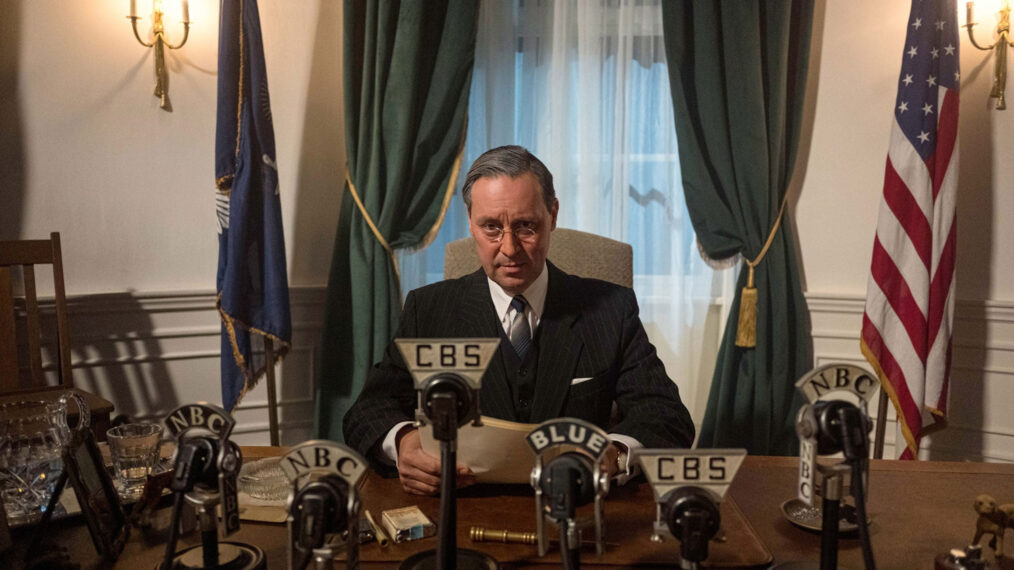
Where is `lights`? This screenshot has height=570, width=1014. lights is located at coordinates (157, 21), (994, 32).